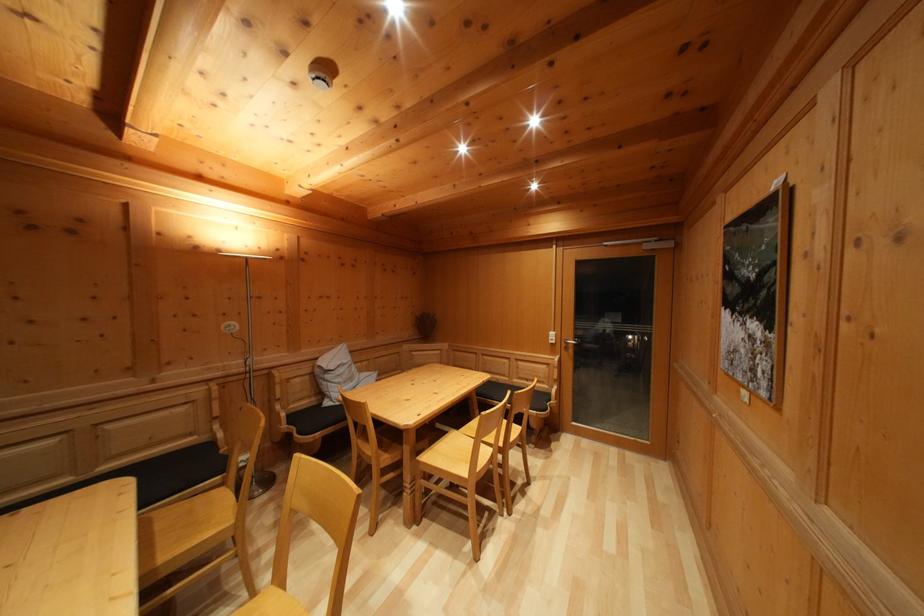
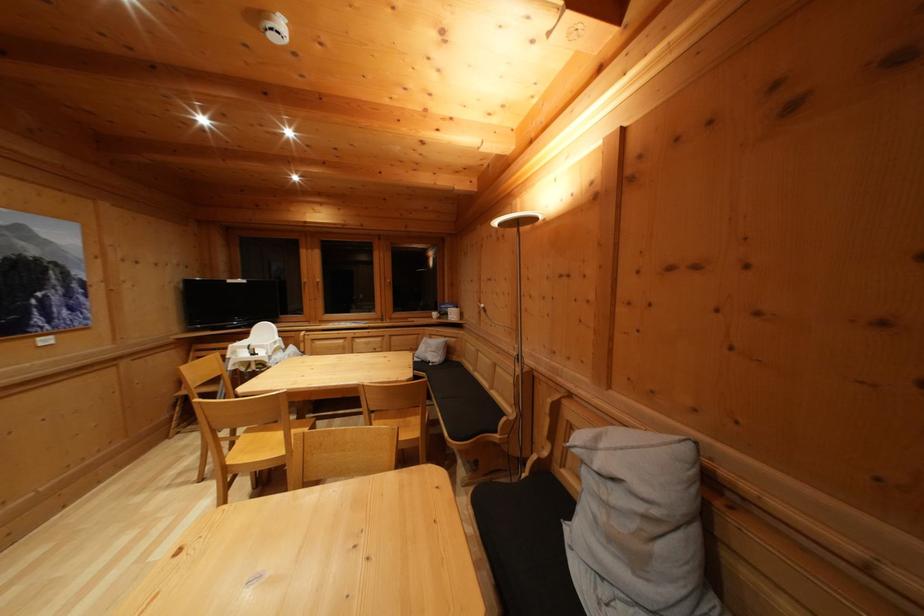
The point at (357,386) is marked in the first image. Where is the corresponding point in the second image?

(640, 565)